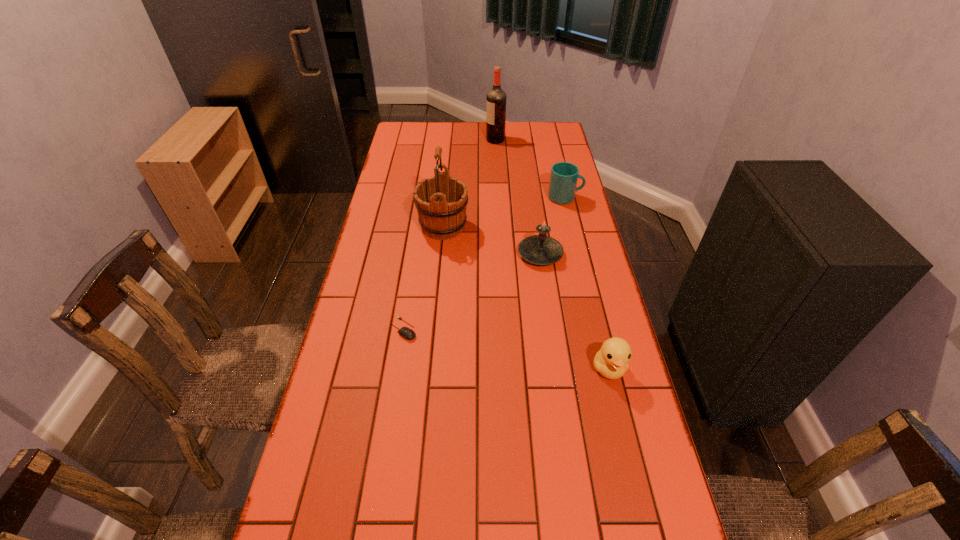
This screenshot has width=960, height=540. Identify the location of the fourth object from right to left. (496, 98).

I want to click on the farthest object, so click(496, 98).

The height and width of the screenshot is (540, 960). Find the location of `wine bucket`. wine bucket is located at coordinates (441, 201).

The image size is (960, 540). Find the location of `candle`. candle is located at coordinates (541, 249).

Where is `the second farthest object`? The image size is (960, 540). the second farthest object is located at coordinates (563, 179).

Find the location of `the nearest object`. the nearest object is located at coordinates click(x=611, y=361).

Locate an element on the screen. mouse is located at coordinates (405, 332).

The width and height of the screenshot is (960, 540). In order to click on the fifth farthest object in this screenshot , I will do `click(405, 332)`.

This screenshot has height=540, width=960. I want to click on vacant space located on the front-facing side of the farthest object, so click(453, 140).

You are a GUI agent. You are given a task and a screenshot of the screen. Output one action in this format:
    pyautogui.click(x=<x>, y=<y>)
    Task: Click on the vacant space situated 0.150m on the front-facing side of the farthest object
    The height and width of the screenshot is (540, 960).
    Given the screenshot: What is the action you would take?
    pyautogui.click(x=453, y=140)